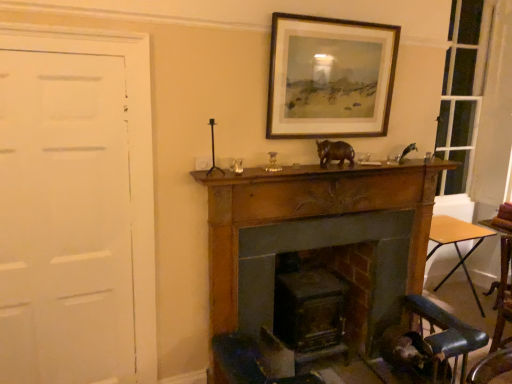
Find the location of a particular element. vacant space situated above smooth wood fireplace at center, which appears as the first fireplace when viewed from the front (from a real-world perspective) is located at coordinates (310, 182).